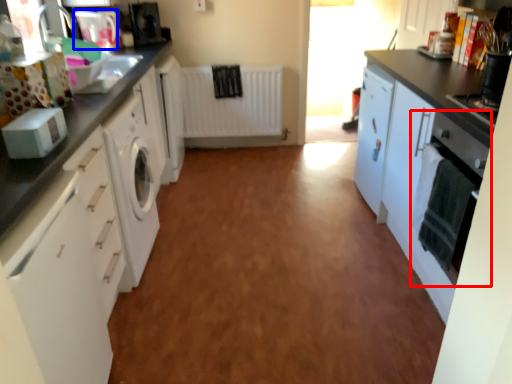
Question: Which point is closer to the camera, home appliance (highlighted by a red box) or appliance (highlighted by a blue box)?

Choices:
 (A) home appliance
 (B) appliance

Answer: (A)